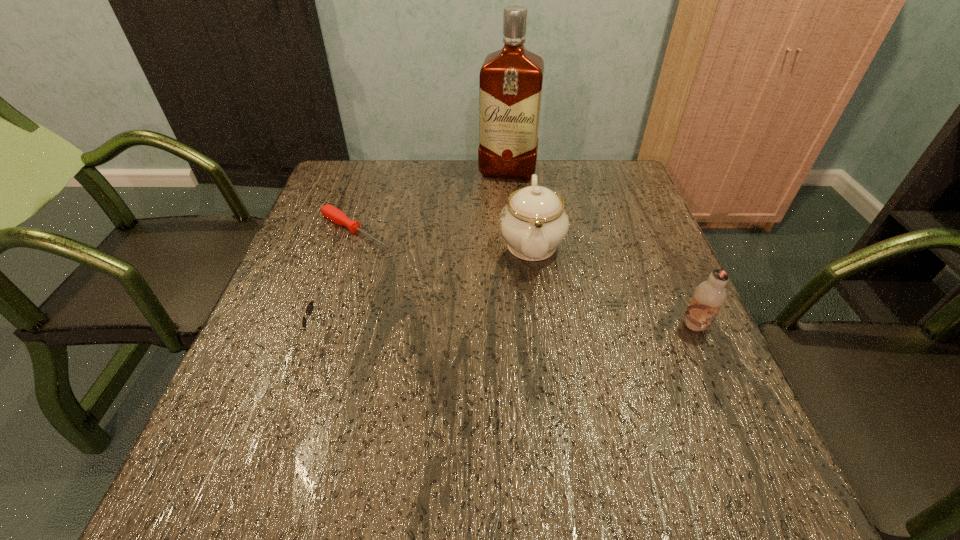
The height and width of the screenshot is (540, 960). I want to click on vacant spot on the desktop that is between the fourth tallest object and the chocolate milk and is positioned at the spout of the chinaware, so click(x=535, y=330).

Identify the location of vacant spot on the desktop that is between the fourth tallest object and the chocolate milk and is positioned at the tip of the shortest object. (519, 330).

The image size is (960, 540). Find the location of `vacant space on the desktop that is between the sunglasses and the rightmost object and is positioned on the front label of the tallest object`. vacant space on the desktop that is between the sunglasses and the rightmost object and is positioned on the front label of the tallest object is located at coordinates (476, 332).